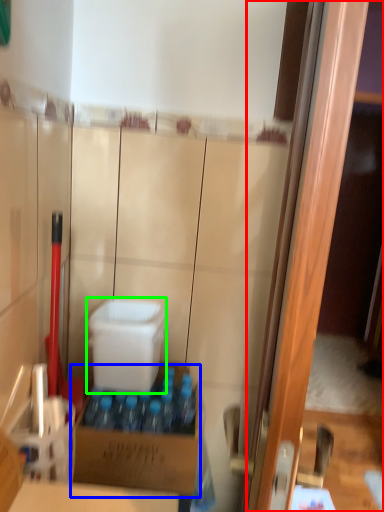
Question: Estimate the real-world distances between objects in this image. Which object is farther from screen door (highlighted by a red box), box (highlighted by a blue box) or box (highlighted by a green box)?

Choices:
 (A) box
 (B) box

Answer: (B)